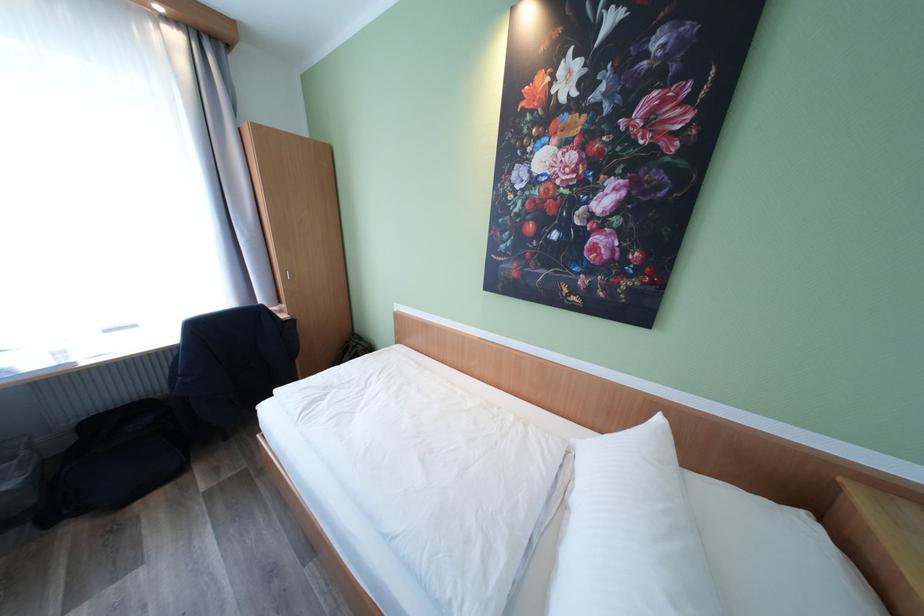
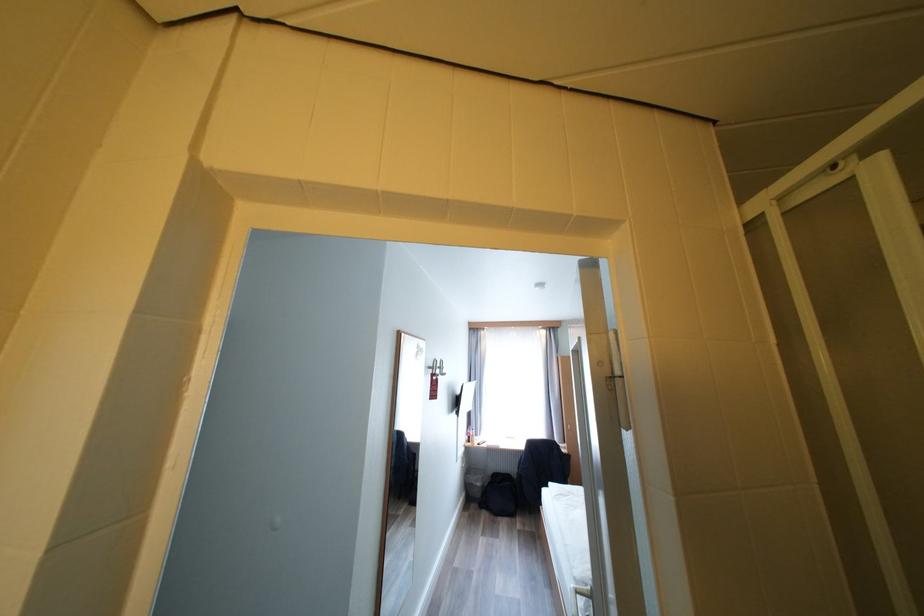
Locate, in the second image, the point that corresponds to point 150,399 in the first image.

(516, 474)